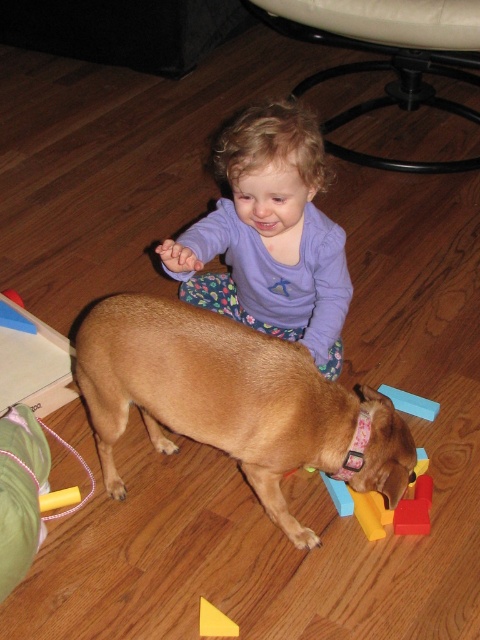
Does point (242, 218) lie behind point (380, 388)?

No, (242, 218) is closer to viewer.

Is purple soft shirt at center below blue rubber block at center?

Actually, purple soft shirt at center is above blue rubber block at center.

Is point (238, 156) in front of point (384, 387)?

That is True.

Locate an element on the screen. purple soft shirt at center is located at coordinates (269, 236).

Between point (384, 403) and point (409, 413), which one is positioned in front?

Point (384, 403) is more forward.

Does point (230, 397) come closer to viewer compared to point (410, 400)?

Yes, it is in front of point (410, 400).

Who is more forward, (309,416) or (420,416)?

Point (309,416)

This screenshot has height=640, width=480. Identify the location of golden brown fur at center. (233, 401).

Can you confirm if golden brown fur at center is wider than yellow plastic triangle at lower center?

Indeed, golden brown fur at center has a greater width compared to yellow plastic triangle at lower center.

Is point (92, 317) less distant than point (211, 611)?

Yes.

Where is `golden brown fur at center`? This screenshot has height=640, width=480. golden brown fur at center is located at coordinates (233, 401).